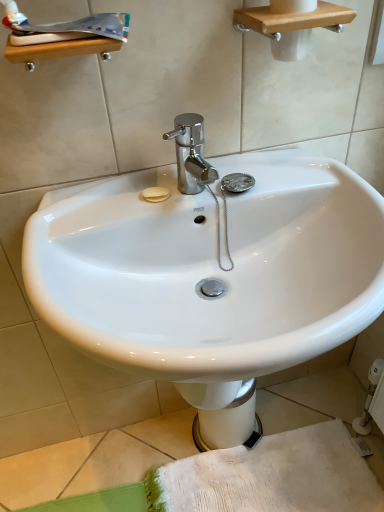
In order to face white glossy bidet at center, should I rotate leftwards or rightwards?

To align with it, rotate right about 4.403°.

The image size is (384, 512). I want to click on white glossy sink at center, so click(210, 270).

What do you see at coordinates (210, 270) in the screenshot?
I see `white glossy sink at center` at bounding box center [210, 270].

Find the location of a particular element. white glossy bidet at center is located at coordinates (223, 413).

Between white glossy sink at center and white glossy bidet at center, which one has smaller size?

white glossy bidet at center.

Does white glossy sink at center have a greater height compared to white glossy bidet at center?

Yes.

Which of these two, white glossy sink at center or white glossy bidet at center, is thinner?

With smaller width is white glossy bidet at center.

Which is behind, white glossy toothpaste at upper left or white glossy sink at center?

Positioned behind is white glossy toothpaste at upper left.

Between white glossy toothpaste at upper left and white glossy sink at center, which one has smaller width?

Thinner between the two is white glossy toothpaste at upper left.

Looking at this image, would you say white glossy toothpaste at upper left is inside or outside white glossy sink at center?

white glossy toothpaste at upper left is not inside white glossy sink at center, it's outside.

Is white glossy toothpaste at upper left at the back of white glossy sink at center?

white glossy sink at center is not turned away from white glossy toothpaste at upper left.

From the picture: From the image's perspective, between white glossy sink at center and white glossy toothpaste at upper left, which one is located above?

white glossy toothpaste at upper left.

Is white glossy toothpaste at upper left surrounded by white glossy sink at center?

No.

Is point (219, 386) positioned in front of point (275, 184)?

That is False.

From a real-world perspective, is white glossy bidet at center physically located above or below white glossy sink at center?

white glossy bidet at center is below white glossy sink at center.

Can you tell me how much white glossy bidet at center and white glossy sink at center differ in facing direction?

The angle between the facing direction of white glossy bidet at center and the facing direction of white glossy sink at center is 3.81 degrees.

From the image's perspective, is white glossy toothpaste at upper left on white glossy bidet at center?

Yes, from the image's perspective, white glossy toothpaste at upper left is over white glossy bidet at center.

Considering the sizes of objects white glossy toothpaste at upper left and white glossy bidet at center in the image provided, who is bigger, white glossy toothpaste at upper left or white glossy bidet at center?

Bigger between the two is white glossy bidet at center.

Considering the sizes of objects white glossy toothpaste at upper left and white glossy bidet at center in the image provided, who is taller, white glossy toothpaste at upper left or white glossy bidet at center?

With more height is white glossy bidet at center.

Between white glossy toothpaste at upper left and white glossy bidet at center, which one has smaller width?

white glossy toothpaste at upper left is thinner.

In terms of height, does white glossy bidet at center look taller or shorter compared to white glossy toothpaste at upper left?

Clearly, white glossy bidet at center is taller compared to white glossy toothpaste at upper left.

Which object is more forward, white glossy bidet at center or white glossy toothpaste at upper left?

white glossy toothpaste at upper left.

In the scene shown: Which of these two, white glossy bidet at center or white glossy toothpaste at upper left, is bigger?

white glossy bidet at center is bigger.

Which is in front, point (251, 428) or point (40, 35)?

The point (40, 35) is more forward.

Locate an element on the screen. bidet located below the white glossy sink at center (from the image's perspective) is located at coordinates (223, 413).

The width and height of the screenshot is (384, 512). In order to click on toothpaste above the white glossy sink at center (from the image's perspective) in this screenshot , I will do `click(71, 27)`.

When comparing their distances from white glossy sink at center, does white glossy toothpaste at upper left or white glossy bidet at center seem closer?

white glossy bidet at center is positioned closer to the anchor white glossy sink at center.

Considering their positions, is white glossy sink at center positioned further to white glossy bidet at center than white glossy toothpaste at upper left?

white glossy toothpaste at upper left is further to white glossy bidet at center.

Estimate the real-world distances between objects in this image. Which object is further from white glossy bidet at center, white glossy toothpaste at upper left or white glossy sink at center?

white glossy toothpaste at upper left.

Which object lies nearer to the anchor point white glossy toothpaste at upper left, white glossy sink at center or white glossy bidet at center?

Among the two, white glossy sink at center is located nearer to white glossy toothpaste at upper left.

Looking at the image, which one is located further to white glossy sink at center, white glossy bidet at center or white glossy toothpaste at upper left?

white glossy toothpaste at upper left lies further to white glossy sink at center than the other object.

Estimate the real-world distances between objects in this image. Which object is closer to white glossy toothpaste at upper left, white glossy bidet at center or white glossy sink at center?

white glossy sink at center.

This screenshot has height=512, width=384. I want to click on sink that lies between white glossy toothpaste at upper left and white glossy bidet at center from top to bottom, so click(210, 270).